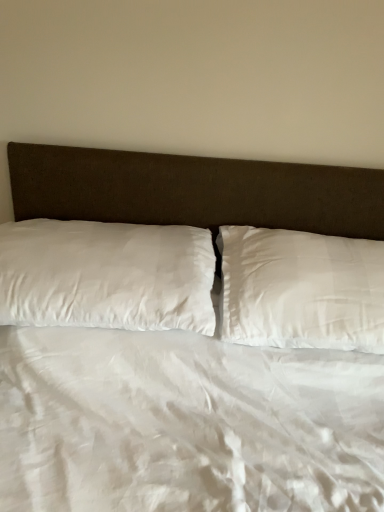
The image size is (384, 512). Describe the element at coordinates (301, 289) in the screenshot. I see `white satin pillow at center, placed as the 1th pillow when sorted from right to left` at that location.

What is the approximate height of white satin pillow at center, placed as the 1th pillow when sorted from right to left?

white satin pillow at center, placed as the 1th pillow when sorted from right to left, is 8.91 inches tall.

At what (x,y) coordinates should I click in order to perform the action: click on white satin pillow at center, placed as the 1th pillow when sorted from right to left. Please return your answer as a coordinate pair (x, y). Looking at the image, I should click on (301, 289).

What do you see at coordinates (106, 275) in the screenshot? The image size is (384, 512). I see `white satin pillow at left, which appears as the 2th pillow when viewed from the right` at bounding box center [106, 275].

This screenshot has width=384, height=512. Find the location of `white satin pillow at left, arranged as the 1th pillow when viewed from the left`. white satin pillow at left, arranged as the 1th pillow when viewed from the left is located at coordinates (106, 275).

What are the coordinates of `white satin pillow at center, positioned as the 2th pillow in left-to-right order` in the screenshot? It's located at (301, 289).

Can you confirm if white satin pillow at left, arranged as the 1th pillow when viewed from the left, is positioned to the right of white satin pillow at center, placed as the 1th pillow when sorted from right to left?

No.

Which object is closer to the camera, white satin pillow at left, which appears as the 2th pillow when viewed from the right, or white satin pillow at center, placed as the 1th pillow when sorted from right to left?

white satin pillow at left, which appears as the 2th pillow when viewed from the right, is more forward.

Is point (5, 234) closer or farther from the camera than point (283, 260)?

Point (5, 234) is positioned closer to the camera compared to point (283, 260).

From the image's perspective, who appears lower, white satin pillow at left, which appears as the 2th pillow when viewed from the right, or white satin pillow at center, positioned as the 2th pillow in left-to-right order?

white satin pillow at center, positioned as the 2th pillow in left-to-right order, is shown below in the image.

From a real-world perspective, is white satin pillow at left, arranged as the 1th pillow when viewed from the left, positioned over white satin pillow at center, placed as the 1th pillow when sorted from right to left, based on gravity?

No, from a real-world perspective, white satin pillow at left, arranged as the 1th pillow when viewed from the left, is not over white satin pillow at center, placed as the 1th pillow when sorted from right to left

Which of these two, white satin pillow at left, which appears as the 2th pillow when viewed from the right, or white satin pillow at center, positioned as the 2th pillow in left-to-right order, is thinner?

Thinner between the two is white satin pillow at center, positioned as the 2th pillow in left-to-right order.

Considering the relative sizes of white satin pillow at left, arranged as the 1th pillow when viewed from the left, and white satin pillow at center, positioned as the 2th pillow in left-to-right order, in the image provided, is white satin pillow at left, arranged as the 1th pillow when viewed from the left, taller than white satin pillow at center, positioned as the 2th pillow in left-to-right order,?

Yes.

Considering the relative sizes of white satin pillow at left, arranged as the 1th pillow when viewed from the left, and white satin pillow at center, placed as the 1th pillow when sorted from right to left, in the image provided, is white satin pillow at left, arranged as the 1th pillow when viewed from the left, bigger than white satin pillow at center, placed as the 1th pillow when sorted from right to left,?

Yes, white satin pillow at left, arranged as the 1th pillow when viewed from the left, is bigger than white satin pillow at center, placed as the 1th pillow when sorted from right to left.

Would you say white satin pillow at left, arranged as the 1th pillow when viewed from the left, is outside white satin pillow at center, placed as the 1th pillow when sorted from right to left?

Absolutely, white satin pillow at left, arranged as the 1th pillow when viewed from the left, is external to white satin pillow at center, placed as the 1th pillow when sorted from right to left.

Would you say white satin pillow at left, arranged as the 1th pillow when viewed from the left, is a long distance from white satin pillow at center, positioned as the 2th pillow in left-to-right order?

white satin pillow at left, arranged as the 1th pillow when viewed from the left, is near white satin pillow at center, positioned as the 2th pillow in left-to-right order, not far away.

Is white satin pillow at left, which appears as the 2th pillow when viewed from the right, facing away from white satin pillow at center, positioned as the 2th pillow in left-to-right order?

white satin pillow at left, which appears as the 2th pillow when viewed from the right, is not turned away from white satin pillow at center, positioned as the 2th pillow in left-to-right order.

How distant is white satin pillow at left, which appears as the 2th pillow when viewed from the right, from white satin pillow at center, placed as the 1th pillow when sorted from right to left?

white satin pillow at left, which appears as the 2th pillow when viewed from the right, is 28.02 centimeters away from white satin pillow at center, placed as the 1th pillow when sorted from right to left.

Where is `pillow in front of the white satin pillow at center, positioned as the 2th pillow in left-to-right order`? pillow in front of the white satin pillow at center, positioned as the 2th pillow in left-to-right order is located at coordinates coord(106,275).

Would you say white satin pillow at center, positioned as the 2th pillow in left-to-right order, is to the left or to the right of white satin pillow at left, arranged as the 1th pillow when viewed from the left, in the picture?

Clearly, white satin pillow at center, positioned as the 2th pillow in left-to-right order, is on the right of white satin pillow at left, arranged as the 1th pillow when viewed from the left, in the image.

Which is behind, white satin pillow at center, positioned as the 2th pillow in left-to-right order, or white satin pillow at left, which appears as the 2th pillow when viewed from the right?

white satin pillow at center, positioned as the 2th pillow in left-to-right order.

Which is in front, point (290, 236) or point (202, 241)?

The point (202, 241) is more forward.

From the image's perspective, which one is positioned higher, white satin pillow at center, placed as the 1th pillow when sorted from right to left, or white satin pillow at left, arranged as the 1th pillow when viewed from the left?

white satin pillow at left, arranged as the 1th pillow when viewed from the left, from the image's perspective.

From a real-world perspective, is white satin pillow at center, placed as the 1th pillow when sorted from right to left, over white satin pillow at left, which appears as the 2th pillow when viewed from the right?

Correct, in the physical world, white satin pillow at center, placed as the 1th pillow when sorted from right to left, is higher than white satin pillow at left, which appears as the 2th pillow when viewed from the right.

Which object is wider, white satin pillow at center, positioned as the 2th pillow in left-to-right order, or white satin pillow at left, which appears as the 2th pillow when viewed from the right?

white satin pillow at left, which appears as the 2th pillow when viewed from the right.

Considering the relative sizes of white satin pillow at center, placed as the 1th pillow when sorted from right to left, and white satin pillow at left, which appears as the 2th pillow when viewed from the right, in the image provided, is white satin pillow at center, placed as the 1th pillow when sorted from right to left, shorter than white satin pillow at left, which appears as the 2th pillow when viewed from the right,?

Yes, white satin pillow at center, placed as the 1th pillow when sorted from right to left, is shorter than white satin pillow at left, which appears as the 2th pillow when viewed from the right.

Considering the sizes of objects white satin pillow at center, positioned as the 2th pillow in left-to-right order, and white satin pillow at left, which appears as the 2th pillow when viewed from the right, in the image provided, who is smaller, white satin pillow at center, positioned as the 2th pillow in left-to-right order, or white satin pillow at left, which appears as the 2th pillow when viewed from the right,?

white satin pillow at center, positioned as the 2th pillow in left-to-right order.

Is white satin pillow at center, positioned as the 2th pillow in left-to-right order, spatially inside white satin pillow at left, which appears as the 2th pillow when viewed from the right, or outside of it?

white satin pillow at center, positioned as the 2th pillow in left-to-right order, exists outside the volume of white satin pillow at left, which appears as the 2th pillow when viewed from the right.

Is white satin pillow at center, placed as the 1th pillow when sorted from right to left, directly adjacent to white satin pillow at left, which appears as the 2th pillow when viewed from the right?

No, white satin pillow at center, placed as the 1th pillow when sorted from right to left, is not touching white satin pillow at left, which appears as the 2th pillow when viewed from the right.

Could you tell me if white satin pillow at center, positioned as the 2th pillow in left-to-right order, is facing white satin pillow at left, arranged as the 1th pillow when viewed from the left?

No, white satin pillow at center, positioned as the 2th pillow in left-to-right order, is not oriented towards white satin pillow at left, arranged as the 1th pillow when viewed from the left.

In the image, there is a white satin pillow at center, placed as the 1th pillow when sorted from right to left. Where is `pillow above it (from the image's perspective)`? pillow above it (from the image's perspective) is located at coordinates (106, 275).

This screenshot has height=512, width=384. Find the location of `pillow beneath the white satin pillow at center, positioned as the 2th pillow in left-to-right order (from a real-world perspective)`. pillow beneath the white satin pillow at center, positioned as the 2th pillow in left-to-right order (from a real-world perspective) is located at coordinates (106, 275).

Where is `pillow above the white satin pillow at left, arranged as the 1th pillow when viewed from the left (from a real-world perspective)`? The height and width of the screenshot is (512, 384). pillow above the white satin pillow at left, arranged as the 1th pillow when viewed from the left (from a real-world perspective) is located at coordinates (301, 289).